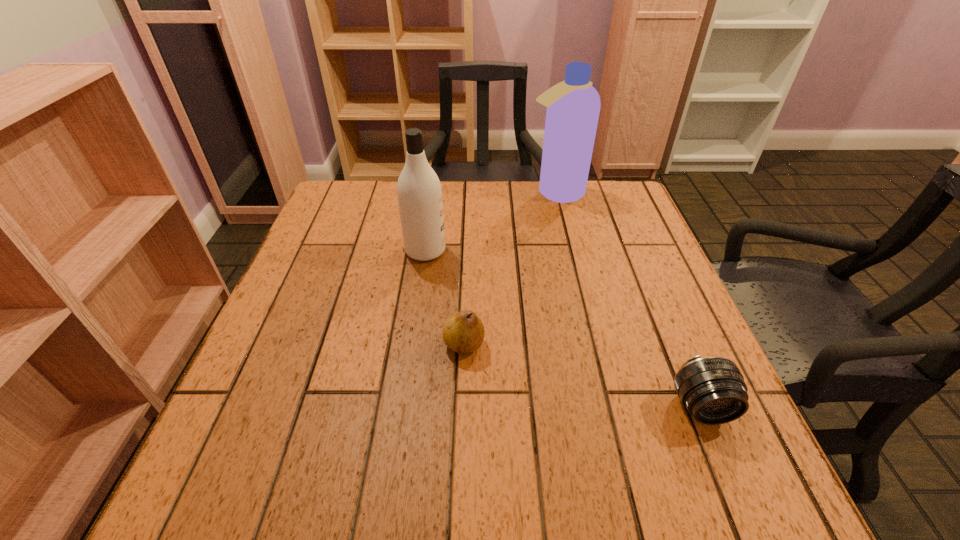
The width and height of the screenshot is (960, 540). I want to click on free space that is in between the third farthest object and the right shampoo, so click(510, 269).

Image resolution: width=960 pixels, height=540 pixels. What are the coordinates of `empty space between the rightmost object and the farther shampoo` in the screenshot? It's located at (629, 300).

Identify the location of empty space between the second farthest object and the second nearest object. This screenshot has height=540, width=960. (444, 298).

Identify the location of object that is the closest to the shorter shampoo. (463, 332).

The image size is (960, 540). I want to click on object that is the nearest to the nearest object, so click(463, 332).

This screenshot has width=960, height=540. I want to click on vacant space that satisfies the following two spatial constraints: 1. on the front-facing side of the pear; 2. on the right side of the left shampoo, so click(412, 345).

Image resolution: width=960 pixels, height=540 pixels. Identify the location of free space that satisfies the following two spatial constraints: 1. on the back side of the third farthest object; 2. on the left side of the right shampoo. (469, 193).

I want to click on free space in the image that satisfies the following two spatial constraints: 1. on the front-facing side of the pear; 2. on the right side of the second farthest object, so click(412, 345).